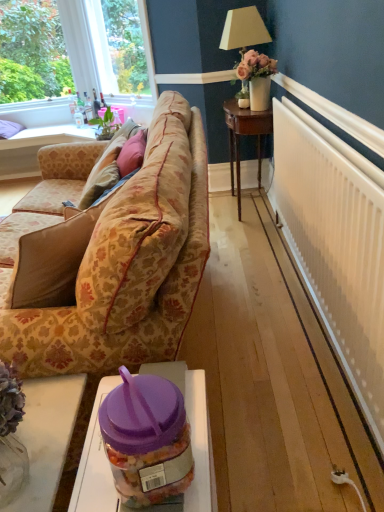
Question: Is clear glass window at upper left smaller than velvet pink pillow at center?

Choices:
 (A) yes
 (B) no

Answer: (B)

Question: Is clear glass window at upper left positioned beyond the bounds of velvet pink pillow at center?

Choices:
 (A) yes
 (B) no

Answer: (A)

Question: Is the position of clear glass window at upper left less distant than that of velvet pink pillow at center?

Choices:
 (A) no
 (B) yes

Answer: (A)

Question: Can you confirm if clear glass window at upper left is positioned to the left of velvet pink pillow at center?

Choices:
 (A) no
 (B) yes

Answer: (B)

Question: Is clear glass window at upper left thinner than velvet pink pillow at center?

Choices:
 (A) yes
 (B) no

Answer: (B)

Question: Is floral-patterned fabric couch at center-left taller or shorter than green leafy plant at upper left?

Choices:
 (A) tall
 (B) short

Answer: (B)

Question: Based on their positions, is floral-patterned fabric couch at center-left located to the left or right of green leafy plant at upper left?

Choices:
 (A) left
 (B) right

Answer: (B)

Question: In the image, is floral-patterned fabric couch at center-left positioned in front of or behind green leafy plant at upper left?

Choices:
 (A) front
 (B) behind

Answer: (A)

Question: Considering the positions of floral-patterned fabric couch at center-left and green leafy plant at upper left in the image, is floral-patterned fabric couch at center-left bigger or smaller than green leafy plant at upper left?

Choices:
 (A) small
 (B) big

Answer: (A)

Question: Is wooden coffee table at lower left, which is counted as the 1th table, starting from the top, wider or thinner than clear glass window at upper left?

Choices:
 (A) wide
 (B) thin

Answer: (A)

Question: Based on their positions, is wooden coffee table at lower left, the third table from the bottom, located to the left or right of clear glass window at upper left?

Choices:
 (A) right
 (B) left

Answer: (B)

Question: Choose the correct answer: Is wooden coffee table at lower left, marked as the 1th table in a left-to-right arrangement, inside clear glass window at upper left or outside it?

Choices:
 (A) outside
 (B) inside

Answer: (A)

Question: Considering the positions of wooden coffee table at lower left, the third table from the bottom, and clear glass window at upper left in the image, is wooden coffee table at lower left, the third table from the bottom, taller or shorter than clear glass window at upper left?

Choices:
 (A) tall
 (B) short

Answer: (B)

Question: In the image, is purple plastic jar at lower center, the third table in the left-to-right sequence, positioned in front of or behind green leafy plant at upper left?

Choices:
 (A) behind
 (B) front

Answer: (B)

Question: Is purple plastic jar at lower center, which is counted as the 3th table, starting from the back, inside the boundaries of green leafy plant at upper left, or outside?

Choices:
 (A) outside
 (B) inside

Answer: (A)